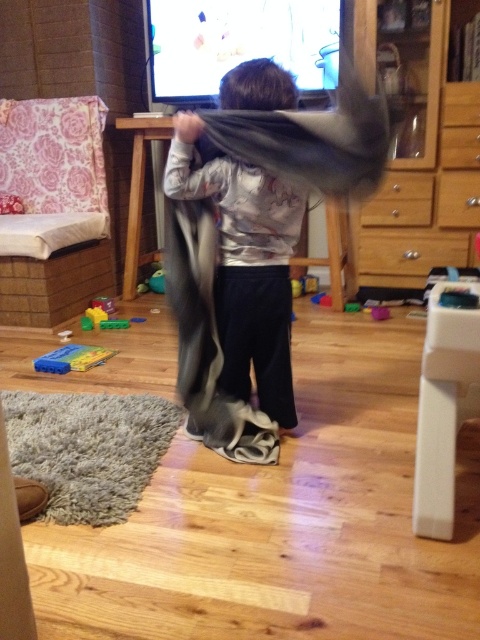
Is gray fabric at center shorter than green plastic toy at center?

No.

Can you confirm if gray fabric at center is positioned above green plastic toy at center?

No, gray fabric at center is not above green plastic toy at center.

At what (x,y) coordinates should I click in order to perform the action: click on gray fabric at center. Please return your answer as a coordinate pair (x, y). The width and height of the screenshot is (480, 640). Looking at the image, I should click on (245, 266).

Is gray fabric at center below gray soft blanket at center?

No.

Is point (305, 204) positioned after point (204, 259)?

Yes, it is behind point (204, 259).

This screenshot has width=480, height=640. Find the location of `gray fabric at center`. gray fabric at center is located at coordinates (245, 266).

Find the location of a particular element. The height and width of the screenshot is (640, 480). gray fabric at center is located at coordinates (245, 266).

Is wooden dresser at center below gray fabric at center?

Actually, wooden dresser at center is above gray fabric at center.

Is point (446, 166) positioned behind point (265, 412)?

That is True.

This screenshot has height=640, width=480. Identify the location of wooden dresser at center. (417, 152).

Locate an element on the screen. The image size is (480, 640). wooden dresser at center is located at coordinates (417, 152).